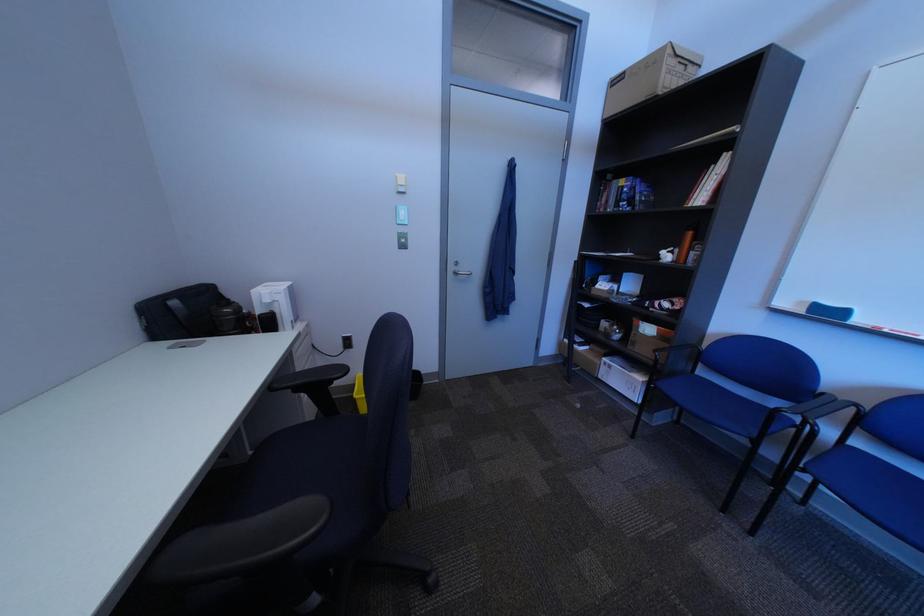
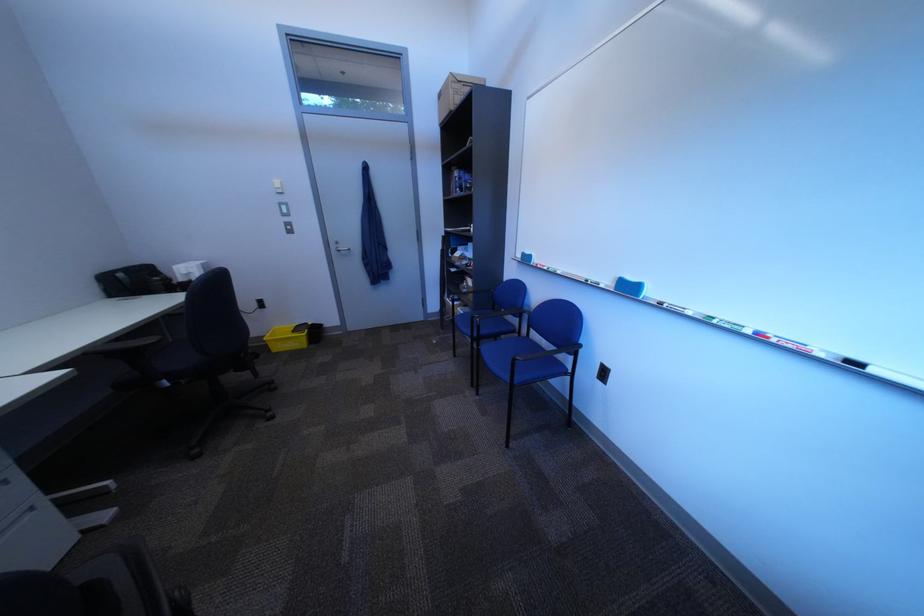
Which direction would the cameraman need to move to produce the second image?

The movement direction of the cameraman is right, backward.